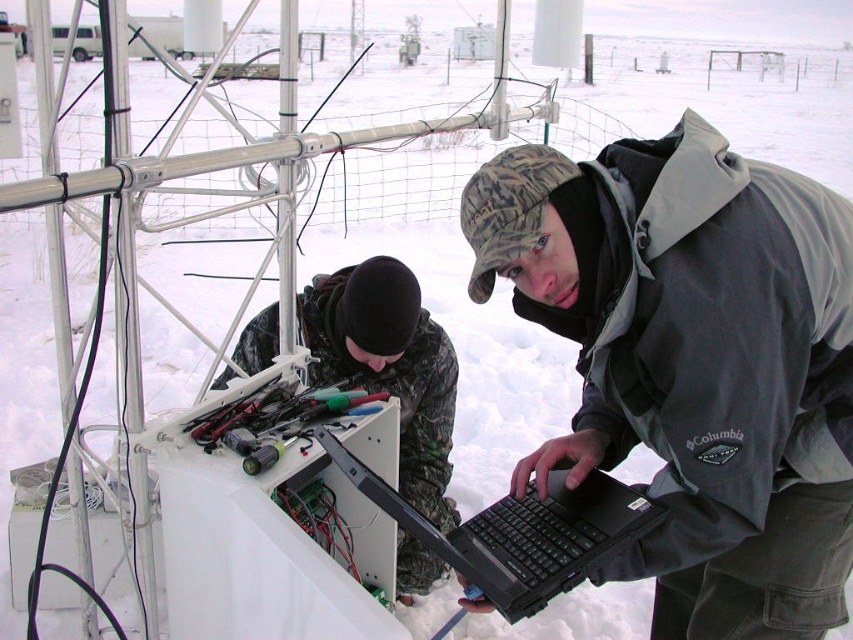
Question: Is gray softshell jacket at center bigger than metallic tools at center?

Choices:
 (A) no
 (B) yes

Answer: (B)

Question: Among these points, which one is farthest from the camera?

Choices:
 (A) (170, 589)
 (B) (566, 472)
 (C) (587, 323)
 (D) (302, 337)

Answer: (D)

Question: Which of the following is the farthest from the observer?

Choices:
 (A) (332, 390)
 (B) (535, 467)
 (C) (403, 284)
 (D) (610, 477)

Answer: (C)

Question: Does camouflage fabric jacket at lower center appear on the left side of black matte laptop at center?

Choices:
 (A) no
 (B) yes

Answer: (B)

Question: Can you confirm if gray softshell jacket at center is bigger than metallic tools at center?

Choices:
 (A) no
 (B) yes

Answer: (B)

Question: Which of the following is the closest to the observer?

Choices:
 (A) (279, 572)
 (B) (509, 182)

Answer: (B)